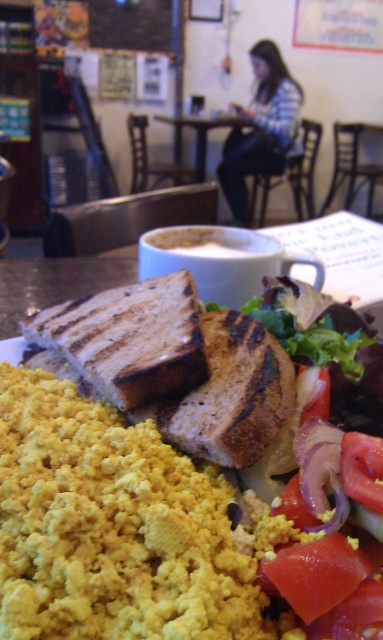
Question: Is grilled bread at center behind white ceramic cup at upper center?

Choices:
 (A) yes
 (B) no

Answer: (B)

Question: Can you confirm if white matte cup at center is wider than white ceramic cup at upper center?

Choices:
 (A) no
 (B) yes

Answer: (A)

Question: Which point is closer to the camera?

Choices:
 (A) grilled bread at center
 (B) white ceramic cup at upper center
 (C) white matte cup at center

Answer: (A)

Question: Which point is farther to the camera?

Choices:
 (A) white matte cup at center
 (B) white ceramic cup at upper center

Answer: (B)

Question: Considering the relative positions of white matte cup at center and white ceramic cup at upper center in the image provided, where is white matte cup at center located with respect to white ceramic cup at upper center?

Choices:
 (A) above
 (B) below

Answer: (B)

Question: Which of the following is the farthest from the observer?

Choices:
 (A) (150, 236)
 (B) (188, 124)

Answer: (B)